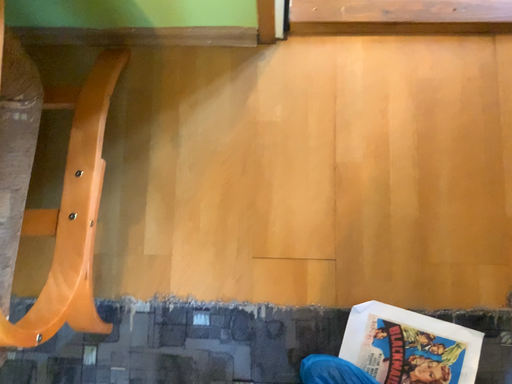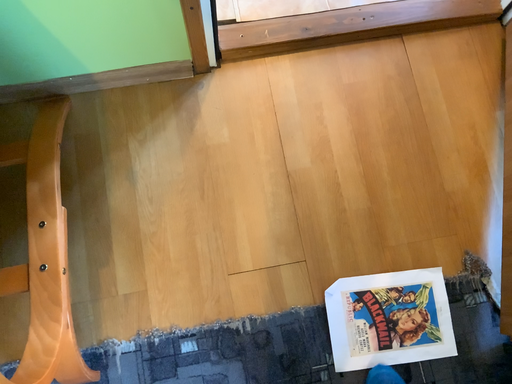
Question: How did the camera likely rotate when shooting the video?

Choices:
 (A) rotated left
 (B) rotated right

Answer: (B)